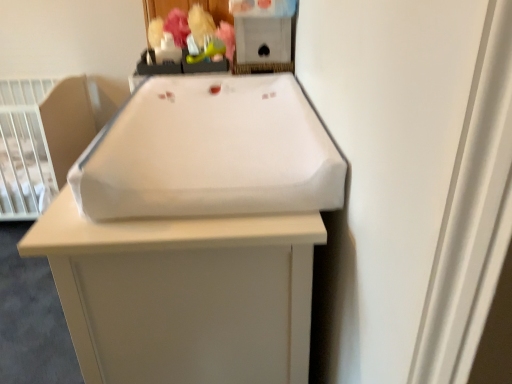
This screenshot has height=384, width=512. I want to click on green rubber toy at upper center, the 2th toy viewed from the left, so click(208, 50).

This screenshot has width=512, height=384. Describe the element at coordinates (210, 152) in the screenshot. I see `white fabric sink at center` at that location.

Where is `white fabric changing pad at center`? The image size is (512, 384). white fabric changing pad at center is located at coordinates (183, 295).

Measure the distance between point (x=61, y=179) and camera.

The depth of point (x=61, y=179) is 7.69 feet.

This screenshot has width=512, height=384. I want to click on white plastic infant bed at left, so click(x=40, y=141).

The image size is (512, 384). I want to click on green rubber toy at upper center, the 2th toy viewed from the left, so click(208, 50).

From the image's perspective, starting from the white fabric sink at center, which toy is the 1st one above? Please provide its 2D coordinates.

[(162, 42)]

Which object is closer to the camera, white fabric sink at center or matte plastic toy at upper center, arranged as the second toy when viewed from the right?

Positioned in front is white fabric sink at center.

From the image's perspective, between white fabric sink at center and matte plastic toy at upper center, arranged as the second toy when viewed from the right, who is located below?

white fabric sink at center appears lower in the image.

Is white fabric sink at center taller or shorter than matte plastic toy at upper center, arranged as the second toy when viewed from the right?

Clearly, white fabric sink at center is taller compared to matte plastic toy at upper center, arranged as the second toy when viewed from the right.

Based on the photo, from the image's perspective, relative to white fabric changing pad at center, is matte plastic toy at upper center, the first toy viewed from the left, above or below?

matte plastic toy at upper center, the first toy viewed from the left, is above white fabric changing pad at center.

Is matte plastic toy at upper center, the first toy viewed from the left, oriented towards white fabric changing pad at center?

No.

Which object is more forward, matte plastic toy at upper center, the first toy viewed from the left, or white fabric changing pad at center?

white fabric changing pad at center is more forward.

How many degrees apart are the facing directions of white fabric sink at center and white fabric changing pad at center?

The angle between the facing direction of white fabric sink at center and the facing direction of white fabric changing pad at center is 0.000793 degrees.

Which object is wider, white fabric sink at center or white fabric changing pad at center?

white fabric changing pad at center is wider.

What are the coordinates of `furniture located behind the white fabric sink at center` in the screenshot? It's located at (183, 295).

Is white fabric changing pad at center far away from green rubber toy at upper center, the 2th toy viewed from the left?

No, white fabric changing pad at center is not far away from green rubber toy at upper center, the 2th toy viewed from the left.

Is green rubber toy at upper center, acting as the first toy starting from the right, at the back of white fabric changing pad at center?

No, white fabric changing pad at center is not facing the opposite direction of green rubber toy at upper center, acting as the first toy starting from the right.

Is white fabric changing pad at center completely or partially outside of green rubber toy at upper center, acting as the first toy starting from the right?

That's correct, white fabric changing pad at center is outside of green rubber toy at upper center, acting as the first toy starting from the right.

From the image's perspective, which one is positioned lower, white fabric changing pad at center or green rubber toy at upper center, acting as the first toy starting from the right?

white fabric changing pad at center appears lower in the image.

In terms of width, does matte plastic toy at upper center, arranged as the second toy when viewed from the right, look wider or thinner when compared to white fabric sink at center?

Considering their sizes, matte plastic toy at upper center, arranged as the second toy when viewed from the right, looks slimmer than white fabric sink at center.

Is matte plastic toy at upper center, arranged as the second toy when viewed from the right, surrounding white fabric sink at center?

Definitely not — white fabric sink at center is not inside matte plastic toy at upper center, arranged as the second toy when viewed from the right.

Relative to white fabric sink at center, is matte plastic toy at upper center, arranged as the second toy when viewed from the right, in front or behind?

In the image, matte plastic toy at upper center, arranged as the second toy when viewed from the right, appears behind white fabric sink at center.

How different are the orientations of matte plastic toy at upper center, the first toy viewed from the left, and white fabric sink at center in degrees?

The angular difference between matte plastic toy at upper center, the first toy viewed from the left, and white fabric sink at center is 2.42 degrees.

Looking at this image, is white fabric sink at center situated inside white plastic infant bed at left or outside?

white fabric sink at center is not inside white plastic infant bed at left, it's outside.

Looking at this image, considering the relative sizes of white fabric sink at center and white plastic infant bed at left in the image provided, is white fabric sink at center smaller than white plastic infant bed at left?

Indeed, white fabric sink at center has a smaller size compared to white plastic infant bed at left.

Looking at this image, which object is further away from the camera, white fabric sink at center or white plastic infant bed at left?

Positioned behind is white plastic infant bed at left.

From the image's perspective, between white fabric sink at center and white plastic infant bed at left, who is located below?

white fabric sink at center is shown below in the image.

Would you say green rubber toy at upper center, acting as the first toy starting from the right, is a long distance from matte plastic toy at upper center, arranged as the second toy when viewed from the right?

No, there isn't a large distance between green rubber toy at upper center, acting as the first toy starting from the right, and matte plastic toy at upper center, arranged as the second toy when viewed from the right.

From the image's perspective, is green rubber toy at upper center, acting as the first toy starting from the right, beneath matte plastic toy at upper center, the first toy viewed from the left?

No, from the image's perspective, green rubber toy at upper center, acting as the first toy starting from the right, is not below matte plastic toy at upper center, the first toy viewed from the left.

Is matte plastic toy at upper center, arranged as the second toy when viewed from the right, at the back of green rubber toy at upper center, acting as the first toy starting from the right?

That's not correct — green rubber toy at upper center, acting as the first toy starting from the right, is not looking away from matte plastic toy at upper center, arranged as the second toy when viewed from the right.

Between green rubber toy at upper center, acting as the first toy starting from the right, and matte plastic toy at upper center, the first toy viewed from the left, which one has larger size?

green rubber toy at upper center, acting as the first toy starting from the right, is bigger.

Find the location of a particular element. Image resolution: width=512 pixels, height=384 pixels. sink below the matte plastic toy at upper center, the first toy viewed from the left (from the image's perspective) is located at coordinates (210, 152).

Image resolution: width=512 pixels, height=384 pixels. In order to click on furniture lying on the right of matte plastic toy at upper center, arranged as the second toy when viewed from the right in this screenshot , I will do `click(183, 295)`.

Which object lies further to the anchor point green rubber toy at upper center, the 2th toy viewed from the left, white fabric sink at center or white fabric changing pad at center?

The object further to green rubber toy at upper center, the 2th toy viewed from the left, is white fabric changing pad at center.

Looking at the image, which one is located further to matte plastic toy at upper center, arranged as the second toy when viewed from the right, green rubber toy at upper center, acting as the first toy starting from the right, or white plastic infant bed at left?

Among the two, white plastic infant bed at left is located further to matte plastic toy at upper center, arranged as the second toy when viewed from the right.

Which object lies further to the anchor point white fabric sink at center, matte plastic toy at upper center, arranged as the second toy when viewed from the right, or white plastic infant bed at left?

white plastic infant bed at left is positioned further to the anchor white fabric sink at center.

Estimate the real-world distances between objects in this image. Which object is further from green rubber toy at upper center, acting as the first toy starting from the right, white plastic infant bed at left or white fabric sink at center?

Among the two, white plastic infant bed at left is located further to green rubber toy at upper center, acting as the first toy starting from the right.

From the image, which object appears to be nearer to matte plastic toy at upper center, the first toy viewed from the left, green rubber toy at upper center, acting as the first toy starting from the right, or white fabric sink at center?

green rubber toy at upper center, acting as the first toy starting from the right, is closer to matte plastic toy at upper center, the first toy viewed from the left.

From the image, which object appears to be farther from white plastic infant bed at left, white fabric changing pad at center or matte plastic toy at upper center, arranged as the second toy when viewed from the right?

white fabric changing pad at center.

Considering their positions, is matte plastic toy at upper center, arranged as the second toy when viewed from the right, positioned closer to green rubber toy at upper center, acting as the first toy starting from the right, than white plastic infant bed at left?

Among the two, matte plastic toy at upper center, arranged as the second toy when viewed from the right, is located nearer to green rubber toy at upper center, acting as the first toy starting from the right.

Looking at the image, which one is located closer to green rubber toy at upper center, acting as the first toy starting from the right, white fabric changing pad at center or white fabric sink at center?

white fabric sink at center.

Where is `toy that lies between green rubber toy at upper center, acting as the first toy starting from the right, and white fabric changing pad at center from top to bottom`? toy that lies between green rubber toy at upper center, acting as the first toy starting from the right, and white fabric changing pad at center from top to bottom is located at coordinates pyautogui.click(x=162, y=42).

Find the location of a particular element. The image size is (512, 384). toy between white fabric sink at center and matte plastic toy at upper center, the first toy viewed from the left, in the front-back direction is located at coordinates (208, 50).

Locate an element on the screen. toy between white plastic infant bed at left and green rubber toy at upper center, the 2th toy viewed from the left is located at coordinates (162, 42).

Identify the location of furniture between white fabric sink at center and white plastic infant bed at left along the z-axis. (183, 295).